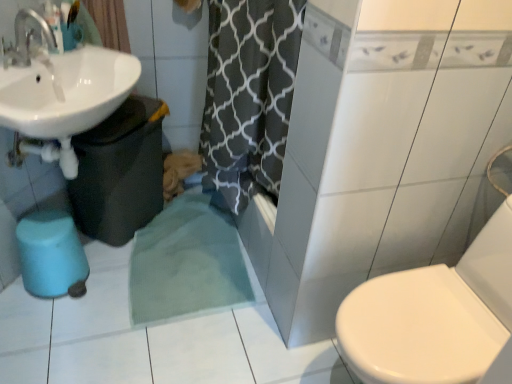
Image resolution: width=512 pixels, height=384 pixels. Find the location of `cotton curtain at upper left`. cotton curtain at upper left is located at coordinates (110, 23).

What is the approximate height of cotton curtain at upper left?

It is 27.69 centimeters.

At what (x,y) coordinates should I click in order to perform the action: click on blue rubber bidet at lower left. Please return your answer as a coordinate pair (x, y). Looking at the image, I should click on coord(51,255).

Does cotton curtain at upper left turn towards white glossy sink at upper left?

Yes, cotton curtain at upper left is turned towards white glossy sink at upper left.

Does cotton curtain at upper left come in front of white glossy sink at upper left?

No, cotton curtain at upper left is behind white glossy sink at upper left.

From the image's perspective, is cotton curtain at upper left positioned above or below white glossy sink at upper left?

cotton curtain at upper left is above white glossy sink at upper left.

From the image's perspective, is blue rubber bidet at lower left positioned above or below white glossy sink at upper left?

From the image's perspective, blue rubber bidet at lower left appears below white glossy sink at upper left.

Is the position of blue rubber bidet at lower left more distant than that of white glossy sink at upper left?

Yes, blue rubber bidet at lower left is behind white glossy sink at upper left.

Looking at this image, who is bigger, blue rubber bidet at lower left or white glossy sink at upper left?

white glossy sink at upper left is bigger.

How different are the orientations of cotton curtain at upper left and blue rubber bidet at lower left in degrees?

There is a 55.7-degree angle between the facing directions of cotton curtain at upper left and blue rubber bidet at lower left.

From the image's perspective, does cotton curtain at upper left appear lower than blue rubber bidet at lower left?

No, from the image's perspective, cotton curtain at upper left is not beneath blue rubber bidet at lower left.

Is cotton curtain at upper left positioned with its back to blue rubber bidet at lower left?

No, blue rubber bidet at lower left is not at the back of cotton curtain at upper left.

Identify the location of curtain above the blue rubber bidet at lower left (from the image's perspective). The image size is (512, 384). (110, 23).

Is blue rubber bidet at lower left not inside cotton curtain at upper left?

Yes, blue rubber bidet at lower left is not within cotton curtain at upper left.

Can you confirm if blue rubber bidet at lower left is bigger than cotton curtain at upper left?

Correct, blue rubber bidet at lower left is larger in size than cotton curtain at upper left.

Is blue rubber bidet at lower left shorter than cotton curtain at upper left?

No, blue rubber bidet at lower left is not shorter than cotton curtain at upper left.

What's the angular difference between white glossy sink at upper left and cotton curtain at upper left's facing directions?

55.7 degrees.

Considering the points (76, 174) and (125, 36), which point is in front, point (76, 174) or point (125, 36)?

The point (76, 174) is closer.

Is the position of white glossy sink at upper left more distant than that of cotton curtain at upper left?

No, it is not.

In order to click on sink below the cotton curtain at upper left (from a real-world perspective) in this screenshot , I will do `click(58, 92)`.

In the scene shown: Is white glossy sink at upper left smaller than blue rubber bidet at lower left?

Actually, white glossy sink at upper left might be larger than blue rubber bidet at lower left.

Which of these two, white glossy sink at upper left or blue rubber bidet at lower left, stands shorter?

With less height is blue rubber bidet at lower left.

Is white glossy sink at upper left not near blue rubber bidet at lower left?

white glossy sink at upper left is near blue rubber bidet at lower left, not far away.

Is white glossy sink at upper left inside the boundaries of blue rubber bidet at lower left, or outside?

white glossy sink at upper left is outside blue rubber bidet at lower left.

Where is `curtain lying behind the white glossy sink at upper left`? The height and width of the screenshot is (384, 512). curtain lying behind the white glossy sink at upper left is located at coordinates (110, 23).

Where is `sink that is on the right side of blue rubber bidet at lower left`? The image size is (512, 384). sink that is on the right side of blue rubber bidet at lower left is located at coordinates (58, 92).

Based on their spatial positions, is cotton curtain at upper left or white glossy sink at upper left further from blue rubber bidet at lower left?

cotton curtain at upper left is further to blue rubber bidet at lower left.

Considering their positions, is cotton curtain at upper left positioned closer to white glossy sink at upper left than blue rubber bidet at lower left?

Among the two, cotton curtain at upper left is located nearer to white glossy sink at upper left.

Based on their spatial positions, is white glossy sink at upper left or cotton curtain at upper left further from blue rubber bidet at lower left?

cotton curtain at upper left is further to blue rubber bidet at lower left.

Estimate the real-world distances between objects in this image. Which object is further from cotton curtain at upper left, white glossy sink at upper left or blue rubber bidet at lower left?

blue rubber bidet at lower left is further to cotton curtain at upper left.

Based on their spatial positions, is blue rubber bidet at lower left or white glossy sink at upper left further from cotton curtain at upper left?

The object further to cotton curtain at upper left is blue rubber bidet at lower left.

When comparing their distances from white glossy sink at upper left, does blue rubber bidet at lower left or cotton curtain at upper left seem closer?

cotton curtain at upper left.

You are a GUI agent. You are given a task and a screenshot of the screen. Output one action in this format:
    pyautogui.click(x=<x>, y=<y>)
    Task: Click on the sink between cotton curtain at upper left and blue rubber bidet at lower left from top to bottom
    The height and width of the screenshot is (384, 512).
    Given the screenshot: What is the action you would take?
    pyautogui.click(x=58, y=92)